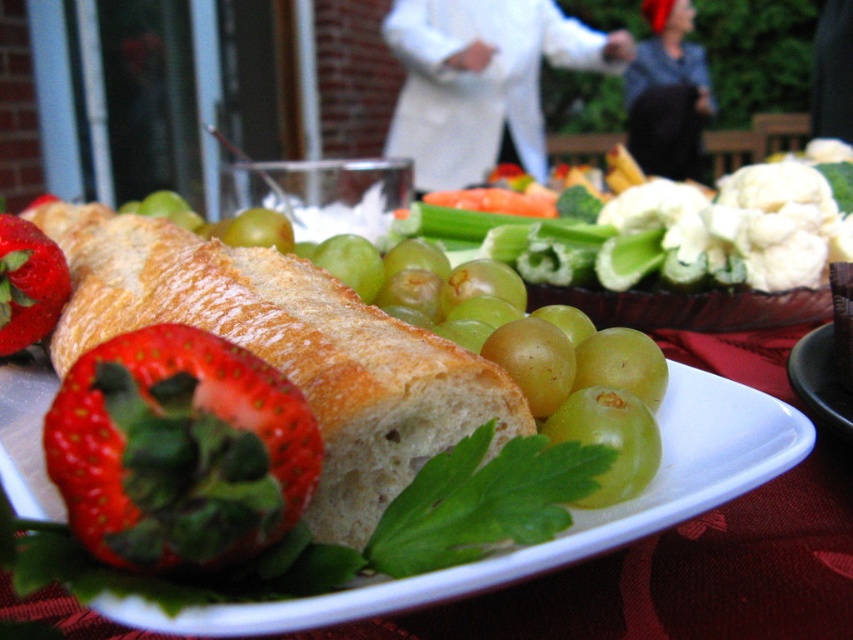
Question: Which point is farther to the camera?

Choices:
 (A) red matte strawberry at lower left
 (B) shiny red strawberry at lower left

Answer: (B)

Question: Is golden brown crusty bread at center behind shiny red strawberry at lower left?

Choices:
 (A) yes
 (B) no

Answer: (B)

Question: Which of the following is the farthest from the observer?

Choices:
 (A) pyautogui.click(x=509, y=83)
 (B) pyautogui.click(x=15, y=234)

Answer: (A)

Question: Considering the real-world distances, which object is closest to the red matte strawberry at lower left?

Choices:
 (A) white fabric at upper center
 (B) shiny red strawberry at lower left

Answer: (B)

Question: Is golden brown crusty bread at center smaller than red matte strawberry at lower left?

Choices:
 (A) yes
 (B) no

Answer: (B)

Question: Is red matte strawberry at lower left to the left of white fabric at upper center from the viewer's perspective?

Choices:
 (A) yes
 (B) no

Answer: (A)